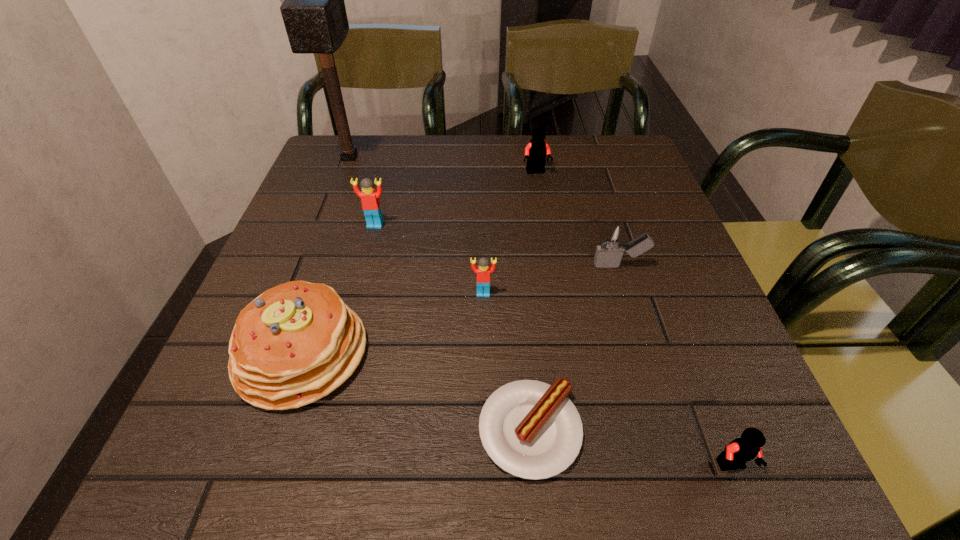
The image size is (960, 540). What are the coordinates of `mallet` in the screenshot? It's located at (314, 14).

You are a GUI agent. You are given a task and a screenshot of the screen. Output one action in this format:
    pyautogui.click(x=<x>, y=<y>)
    Task: Click on the third nearest Lego
    
    Given the screenshot: What is the action you would take?
    pyautogui.click(x=369, y=196)

Where is `the bigger red Lego`? the bigger red Lego is located at coordinates (369, 196).

The image size is (960, 540). I want to click on the second Lego from right to left, so click(x=536, y=151).

Image resolution: width=960 pixels, height=540 pixels. Identify the location of the farthest Lego. (536, 151).

The image size is (960, 540). Find the location of `the fourth farthest object`. the fourth farthest object is located at coordinates (613, 238).

Locate an element on the screen. The height and width of the screenshot is (540, 960). gray igniter is located at coordinates (613, 238).

Locate an element on the screen. Image resolution: width=960 pixels, height=540 pixels. pancake is located at coordinates coord(297,342).

You are a GUI agent. You are given a task and a screenshot of the screen. Output one action in this format:
    pyautogui.click(x=<x>, y=<y>)
    Task: Click on the fourth nearest object
    
    Given the screenshot: What is the action you would take?
    click(483, 270)

Find the location of a particular element. This screenshot has height=540, width=960. the right red Lego is located at coordinates (483, 270).